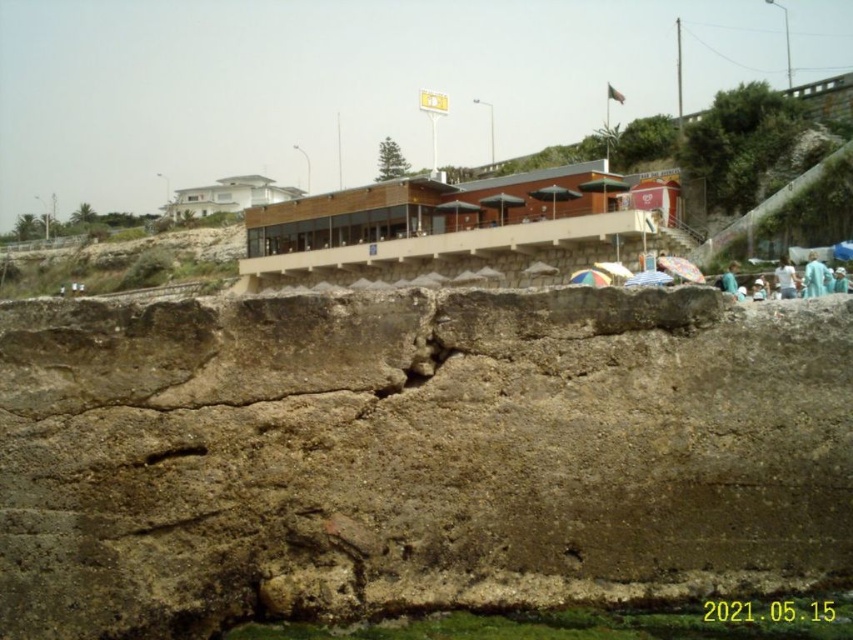
You are a delivery person carrying a package that requires a flat surface to place. You see the brown rough rock at lower center and the light blue fabric at lower right. Which location would be suitable for placing the package?

The light blue fabric at lower right is a suitable location because it provides a flat surface, unlike the brown rough rock at lower center which has a rough and uneven texture.